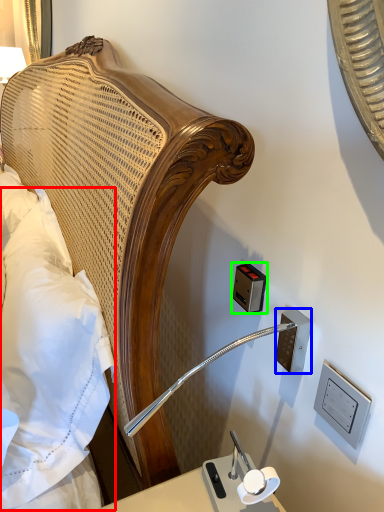
Question: Estimate the real-world distances between objects in this image. Which object is farther from pillow (highlighted by a red box), electric outlet (highlighted by a blue box) or electric outlet (highlighted by a green box)?

Choices:
 (A) electric outlet
 (B) electric outlet

Answer: (A)